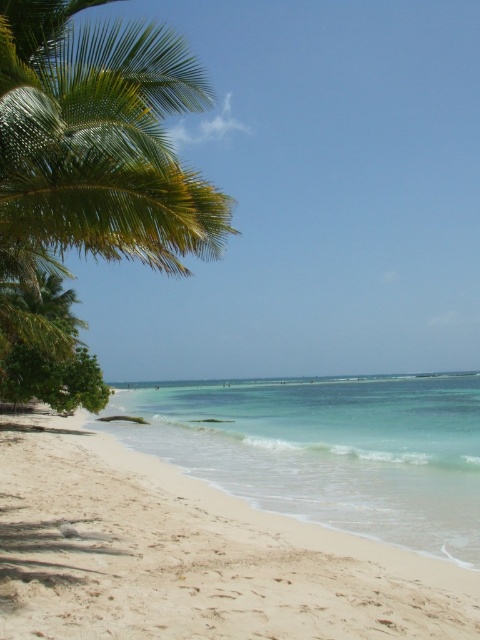
Does white sandy beach at lower left have a larger size compared to green leafy palm tree at left?

No, white sandy beach at lower left is not bigger than green leafy palm tree at left.

Which is above, white sandy beach at lower left or green leafy palm tree at left?

green leafy palm tree at left is above.

Image resolution: width=480 pixels, height=640 pixels. I want to click on white sandy beach at lower left, so click(191, 556).

Which is in front, point (73, 440) or point (307, 480)?

Point (307, 480) is in front.

Can you confirm if white sandy beach at lower left is shorter than clear blue water at center?

Yes, white sandy beach at lower left is shorter than clear blue water at center.

Where is `white sandy beach at lower left`? Image resolution: width=480 pixels, height=640 pixels. white sandy beach at lower left is located at coordinates (191, 556).

Where is `white sandy beach at lower left`? white sandy beach at lower left is located at coordinates (191, 556).

Who is higher up, green leafy palm tree at left or clear blue water at center?

green leafy palm tree at left is above.

Is point (184, 51) positioned in front of point (156, 401)?

That is True.

Locate an element on the screen. green leafy palm tree at left is located at coordinates (x=88, y=177).